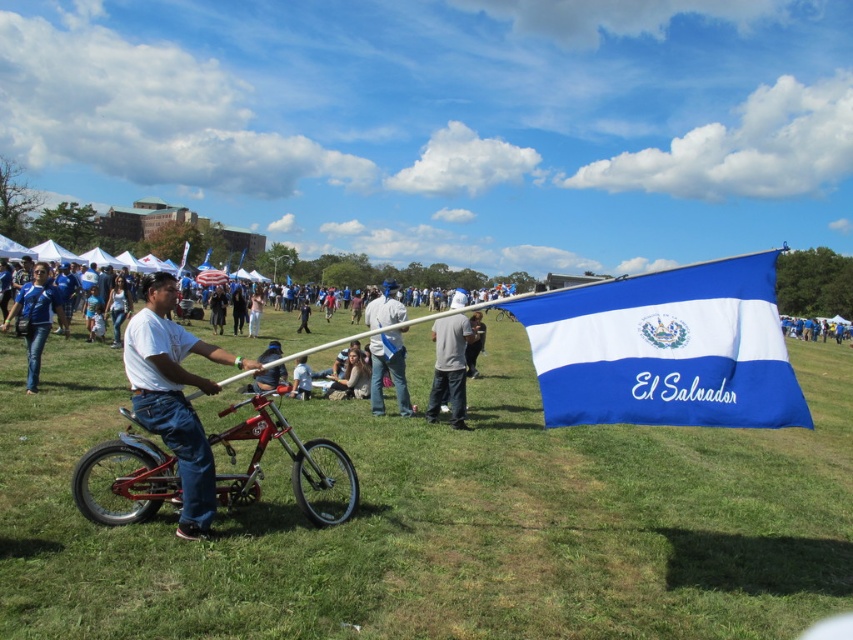
Is shiny red bicycle at center positioned behind white matte shirt at center?

Yes, shiny red bicycle at center is behind white matte shirt at center.

The height and width of the screenshot is (640, 853). Describe the element at coordinates (291, 468) in the screenshot. I see `shiny red bicycle at center` at that location.

Who is more forward, (279, 417) or (199, 340)?

Positioned in front is point (199, 340).

Identify the location of shiny red bicycle at center. The width and height of the screenshot is (853, 640). (291, 468).

The height and width of the screenshot is (640, 853). What do you see at coordinates (450, 368) in the screenshot?
I see `gray cotton shirt at center` at bounding box center [450, 368].

In the scene shown: Does gray cotton shirt at center have a greater height compared to matte blue shirt at left?

Yes.

Where is `gray cotton shirt at center`? This screenshot has height=640, width=853. gray cotton shirt at center is located at coordinates point(450,368).

This screenshot has width=853, height=640. I want to click on gray cotton shirt at center, so click(x=450, y=368).

Can you confirm if shiny red bicycle at center is thinner than light blue fabric flag at center?

Yes, shiny red bicycle at center is thinner than light blue fabric flag at center.

Which is behind, point (325, 456) or point (405, 388)?

Positioned behind is point (405, 388).

Is point (316, 458) positioned after point (379, 394)?

That is False.

The height and width of the screenshot is (640, 853). I want to click on shiny red bicycle at center, so click(291, 468).